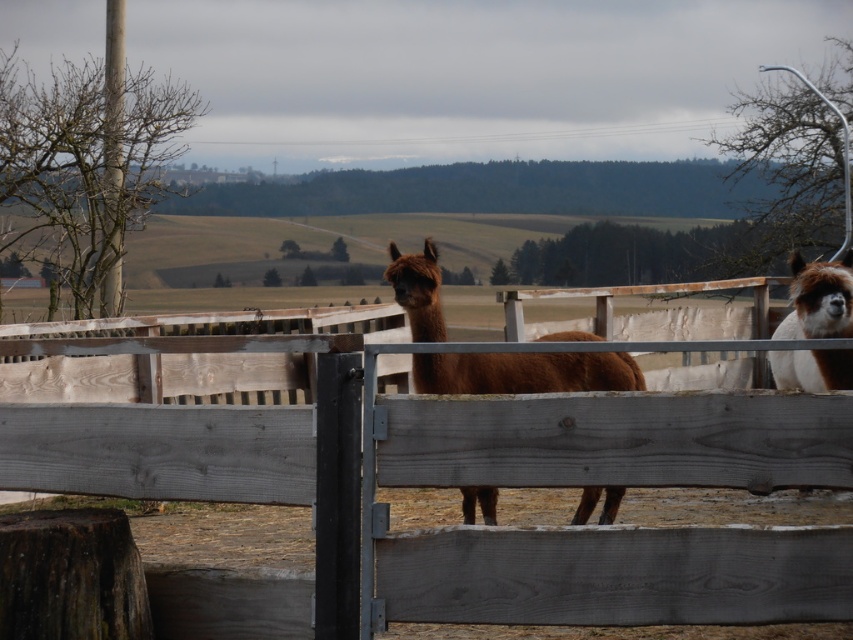
Question: Which object is positioned farthest from the brown wooden fence at center?

Choices:
 (A) brown woolly alpaca at right
 (B) brown woolly alpaca at center

Answer: (A)

Question: Which of the following is the farthest from the observer?

Choices:
 (A) (811, 284)
 (B) (608, 522)
 (C) (547, 417)

Answer: (B)

Question: In this image, where is brown woolly alpaca at center located relative to brown woolly alpaca at right?

Choices:
 (A) right
 (B) left

Answer: (B)

Question: Among these objects, which one is farthest from the camera?

Choices:
 (A) brown wooden fence at center
 (B) brown woolly alpaca at right
 (C) brown woolly alpaca at center

Answer: (B)

Question: Is brown wooden fence at center smaller than brown woolly alpaca at right?

Choices:
 (A) no
 (B) yes

Answer: (A)

Question: Does brown woolly alpaca at center have a lesser width compared to brown woolly alpaca at right?

Choices:
 (A) no
 (B) yes

Answer: (A)